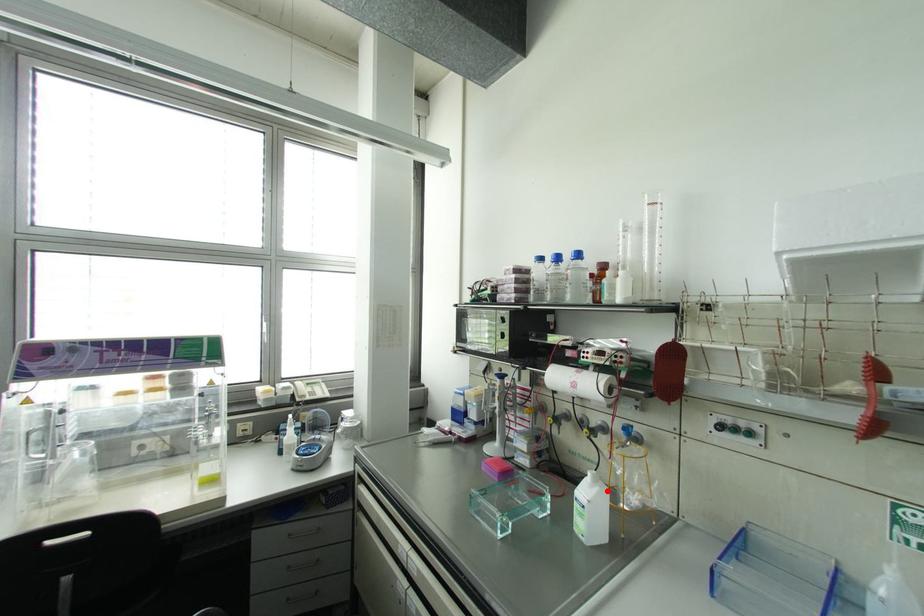
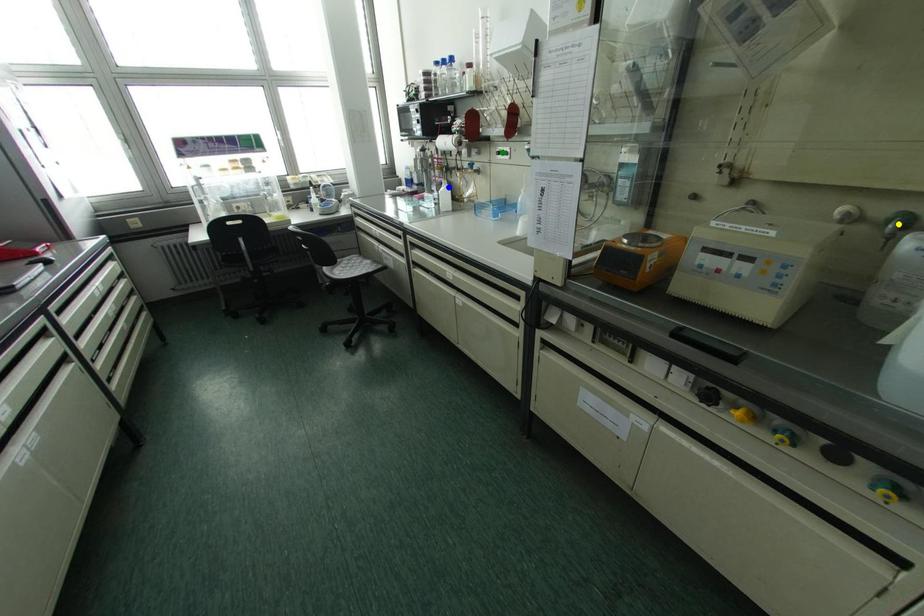
Question: I am providing you with two images of the same scene from different viewpoints. A red point is marked on the first image. You are given multiple points on the second image. Which point in image 2 represents the same 3d spot as the red point in image 1?

Choices:
 (A) yellow point
 (B) green point
 (C) blue point

Answer: (C)